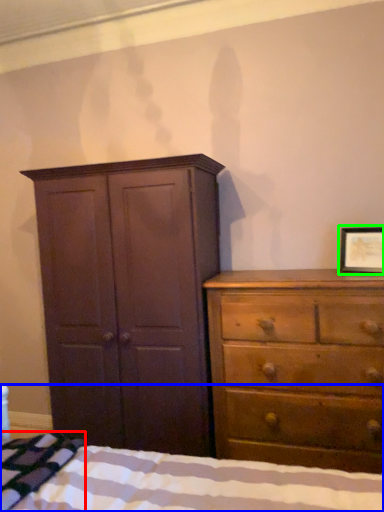
Question: Which object is the farthest from blanket (highlighted by a red box)? Choose among these: bed (highlighted by a blue box) or picture frame (highlighted by a green box).

Choices:
 (A) bed
 (B) picture frame

Answer: (B)